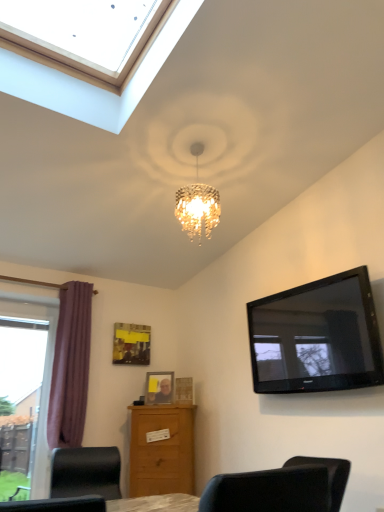
Locate an element on the screen. The height and width of the screenshot is (512, 384). vacant region in front of matte plastic picture frame at center, the 2th picture frame viewed from the right is located at coordinates (158, 406).